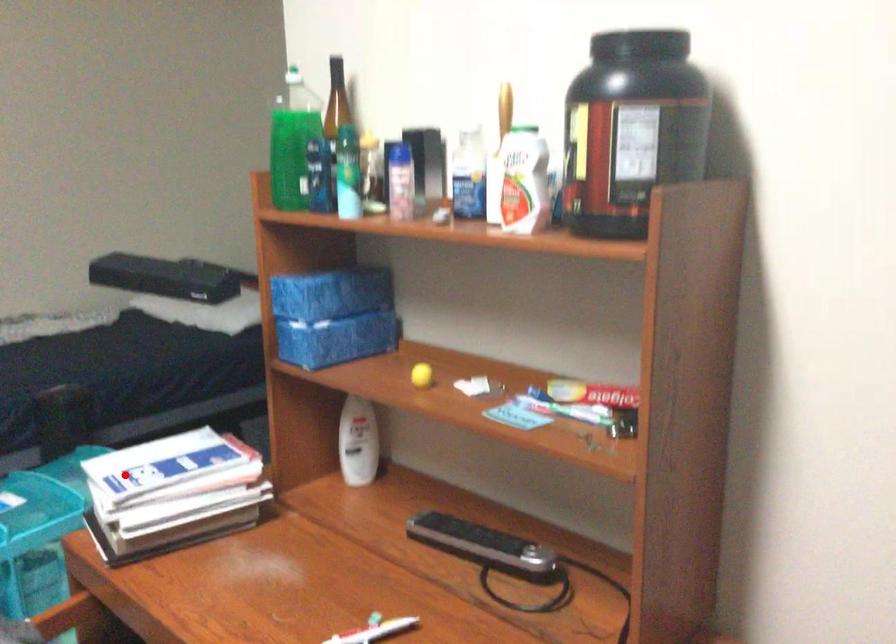
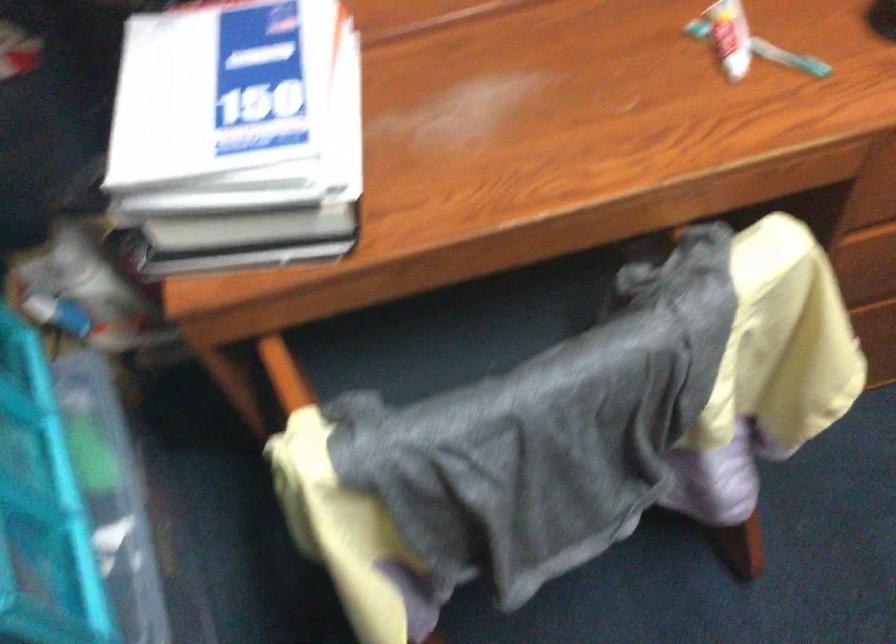
Find the pixel in the second image that matches the highlighted location in the first image.

(237, 128)